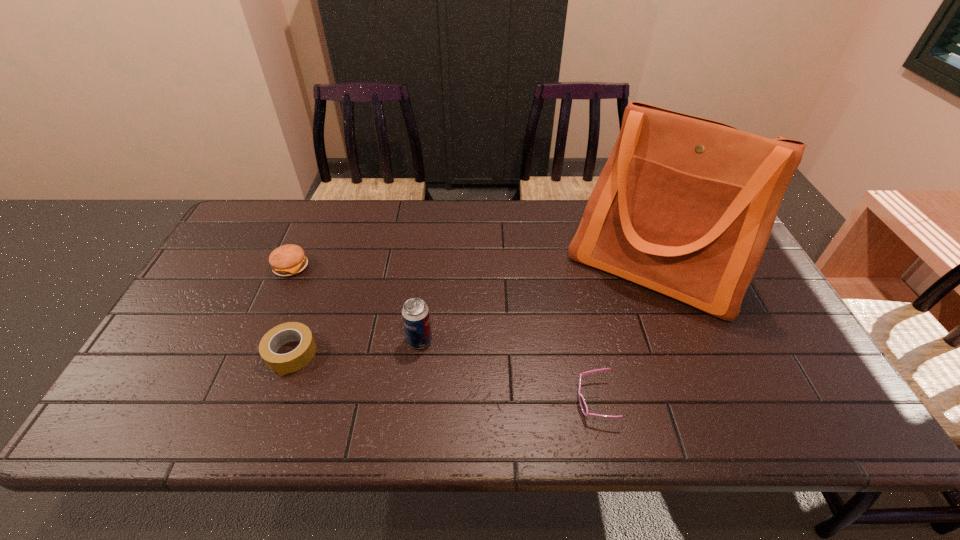
Identify the location of shopping bag. The height and width of the screenshot is (540, 960). (684, 206).

Where is `beer can`? beer can is located at coordinates (415, 313).

The height and width of the screenshot is (540, 960). Find the location of `the third object from left to right`. the third object from left to right is located at coordinates (415, 313).

At what (x,y) coordinates should I click in order to perform the action: click on the third shortest object. Please return your answer as a coordinate pair (x, y). The image size is (960, 540). Looking at the image, I should click on (287, 260).

This screenshot has width=960, height=540. In order to click on duct tape in this screenshot , I will do `click(297, 359)`.

At what (x,y) coordinates should I click in order to perform the action: click on the nearest object. Please return your answer as a coordinate pair (x, y). The width and height of the screenshot is (960, 540). Looking at the image, I should click on (583, 405).

I want to click on blank area located on the front of the tallest object, so click(706, 390).

Locate an element on the screen. This screenshot has height=540, width=960. vacant point located on the left of the second tallest object is located at coordinates (348, 340).

The image size is (960, 540). Identify the location of vacant area situated on the back of the third tallest object. (319, 202).

Where is `vacant area situated at the edge of the duct tape`? vacant area situated at the edge of the duct tape is located at coordinates (274, 400).